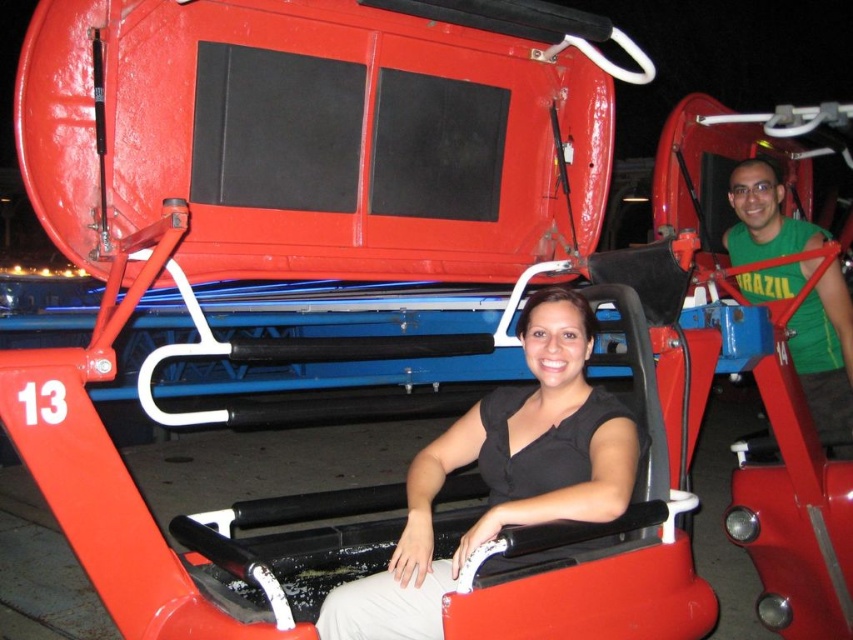
Is point (583, 376) positioned after point (851, 324)?

No, (583, 376) is in front of (851, 324).

Does black matte shirt at center lie in front of green fabric shirt at right?

That is True.

The image size is (853, 640). Describe the element at coordinates (503, 474) in the screenshot. I see `black matte shirt at center` at that location.

Locate an element on the screen. The height and width of the screenshot is (640, 853). black matte shirt at center is located at coordinates (503, 474).